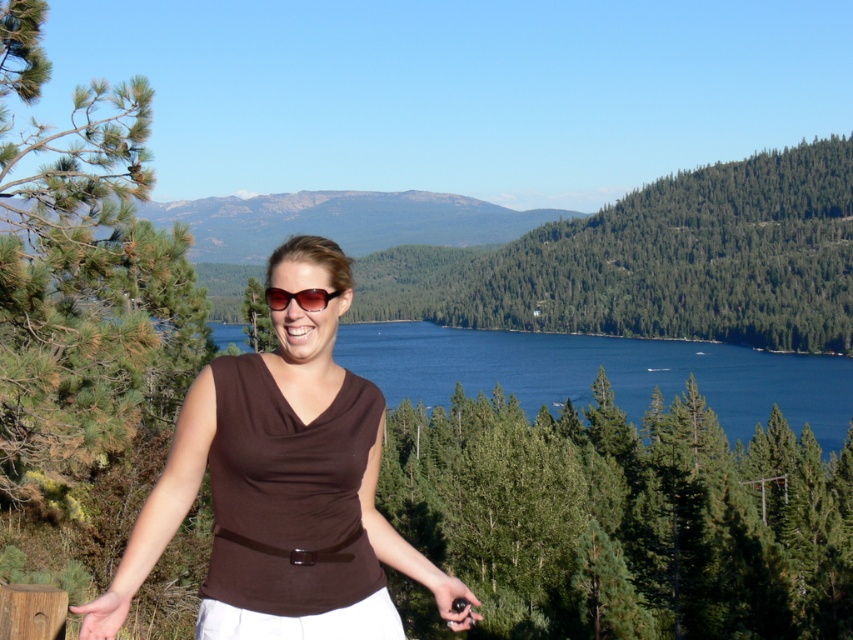
Does rocky gray mountain at upper center have a larger size compared to brown matte sunglasses at center?

Correct, rocky gray mountain at upper center is larger in size than brown matte sunglasses at center.

Describe the element at coordinates (341, 220) in the screenshot. I see `rocky gray mountain at upper center` at that location.

Between point (403, 236) and point (322, 301), which one is positioned behind?

The point (403, 236) is behind.

Image resolution: width=853 pixels, height=640 pixels. Identify the location of rocky gray mountain at upper center. (341, 220).

Can you confirm if brown fabric shirt at center is bigger than brown matte sunglasses at center?

Indeed, brown fabric shirt at center has a larger size compared to brown matte sunglasses at center.

Does brown fabric shirt at center appear over brown matte sunglasses at center?

No.

Is point (306, 323) behind point (276, 298)?

No, it is in front of (276, 298).

Find the location of `brown fabric shirt at center`. brown fabric shirt at center is located at coordinates click(281, 474).

Does brown fabric shirt at center have a greater width compared to rocky gray mountain at upper center?

No.

Is brown fabric shirt at center below rocky gray mountain at upper center?

Yes, brown fabric shirt at center is below rocky gray mountain at upper center.

This screenshot has height=640, width=853. In order to click on brown fabric shirt at center in this screenshot , I will do `click(281, 474)`.

The height and width of the screenshot is (640, 853). Find the location of `brown fabric shirt at center`. brown fabric shirt at center is located at coordinates (281, 474).